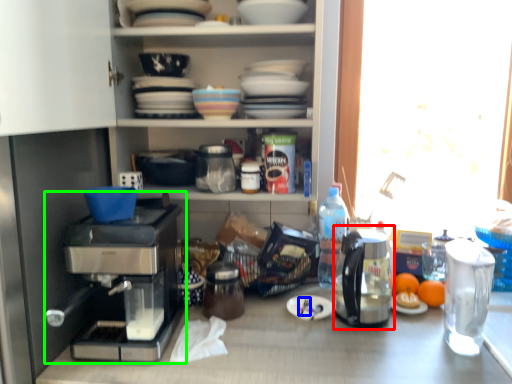
Question: Based on their relative distances, which object is nearer to coffeepot (highlighted by a red box)? Choose from silverware (highlighted by a blue box) and coffee maker (highlighted by a green box).

Choices:
 (A) silverware
 (B) coffee maker

Answer: (A)